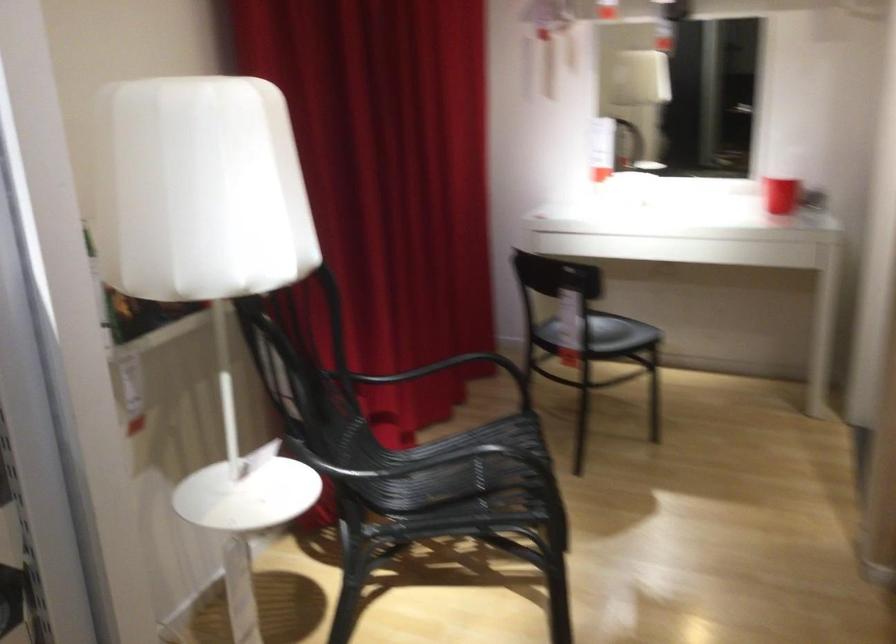
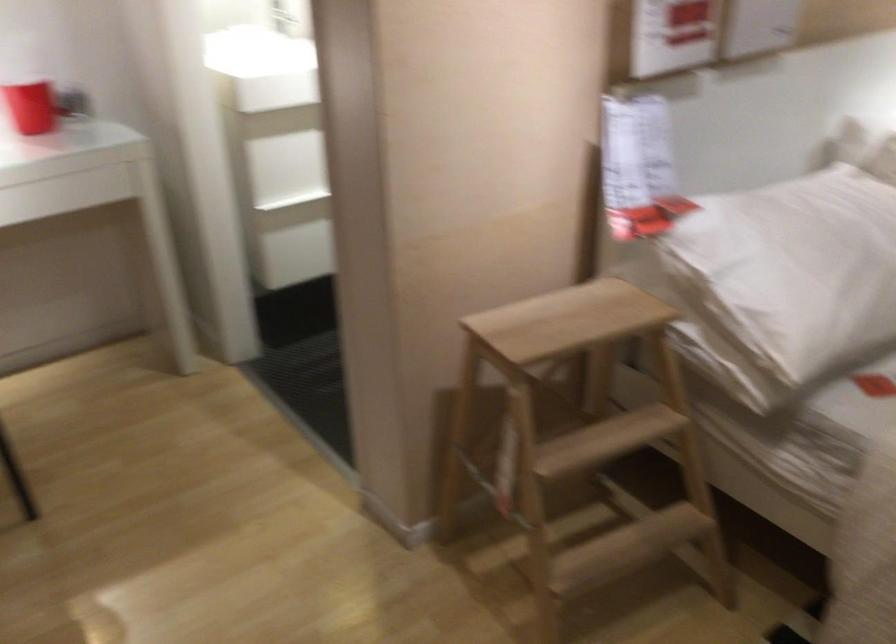
Locate, in the second image, the point that corresponds to point 797,169 in the first image.

(30, 105)